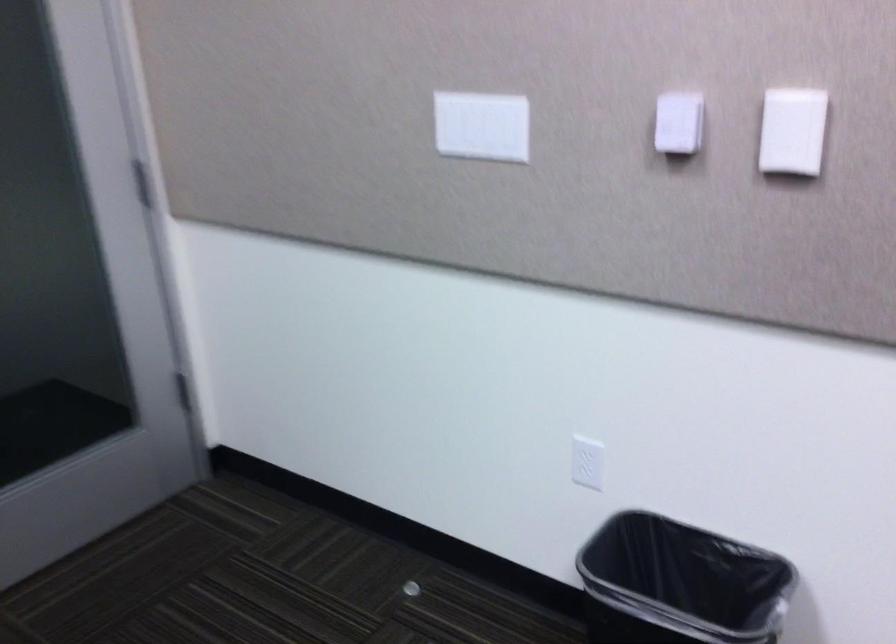
Identify the location of folded paper note. (791, 131).